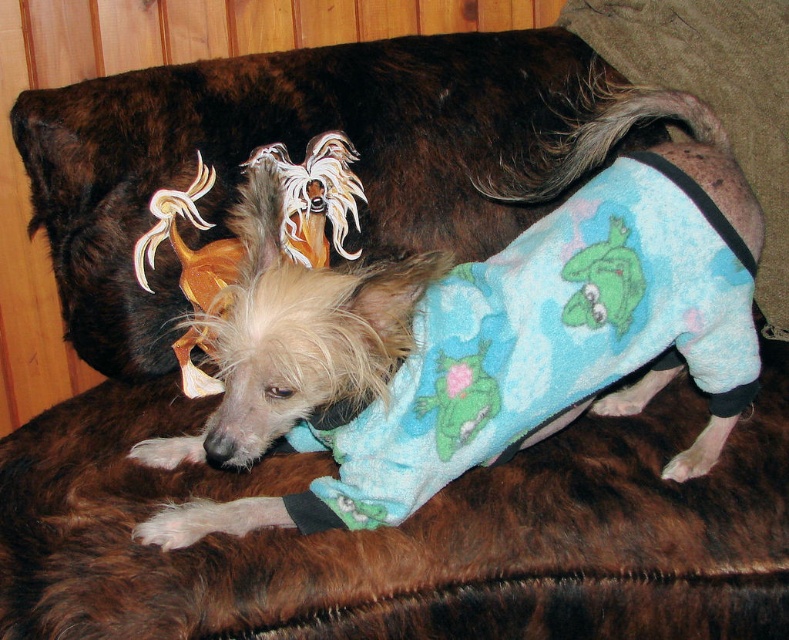
You are trying to decide whether the blue fleece pajamas at center can fully cover the green plush frog at upper center. Based on their sizes, what do you think?

The blue fleece pajamas at center are larger than the green plush frog at upper center, so they can fully cover it.